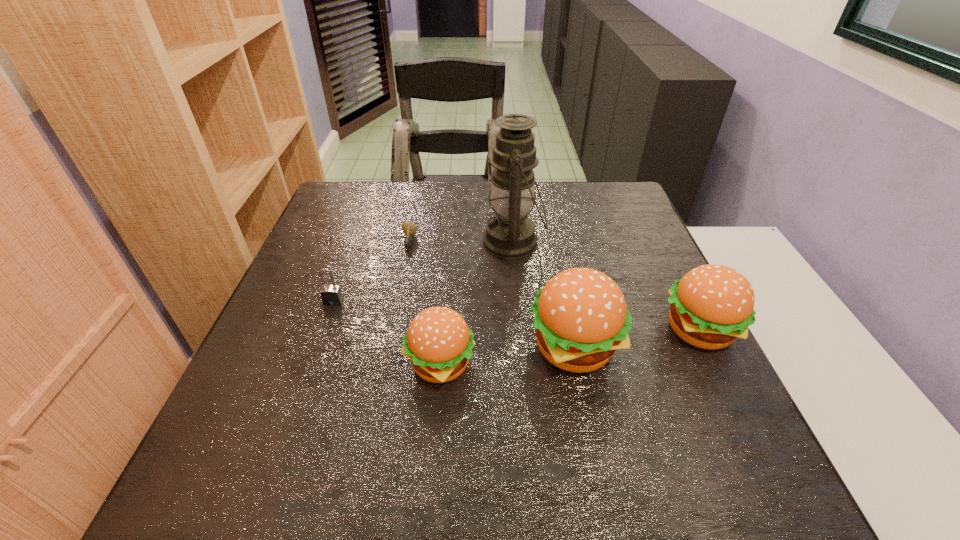
This screenshot has height=540, width=960. In order to click on blank area located 0.240m on the back of the leftmost hamburger in this screenshot , I will do `click(448, 264)`.

Image resolution: width=960 pixels, height=540 pixels. I want to click on vacant area located 0.190m on the left of the second hamburger from left to right, so click(x=433, y=347).

Image resolution: width=960 pixels, height=540 pixels. In order to click on free space located on the back of the third tallest object in this screenshot , I will do `click(659, 251)`.

The height and width of the screenshot is (540, 960). What are the coordinates of `vacant position located on the right of the oil lamp` in the screenshot? It's located at (632, 242).

Where is `blank space located on the front-facing side of the second object from left to right`? The width and height of the screenshot is (960, 540). blank space located on the front-facing side of the second object from left to right is located at coordinates (396, 310).

At what (x,y) coordinates should I click in order to perform the action: click on blank space located on the shackle of the fifth tallest object. Please return your answer as a coordinate pair (x, y). Looking at the image, I should click on (286, 435).

This screenshot has height=540, width=960. Identify the location of object that is positioned at the far edge. (509, 234).

Locate an element on the screen. The width and height of the screenshot is (960, 540). object present at the left edge is located at coordinates (331, 295).

Where is `object that is at the right edge`? This screenshot has height=540, width=960. object that is at the right edge is located at coordinates (712, 305).

You are a GUI agent. You are given a task and a screenshot of the screen. Output one action in this format:
    pyautogui.click(x=<x>, y=<y>)
    Task: Click on the free space at the far edge
    This screenshot has width=960, height=540.
    Given the screenshot: What is the action you would take?
    pyautogui.click(x=388, y=191)